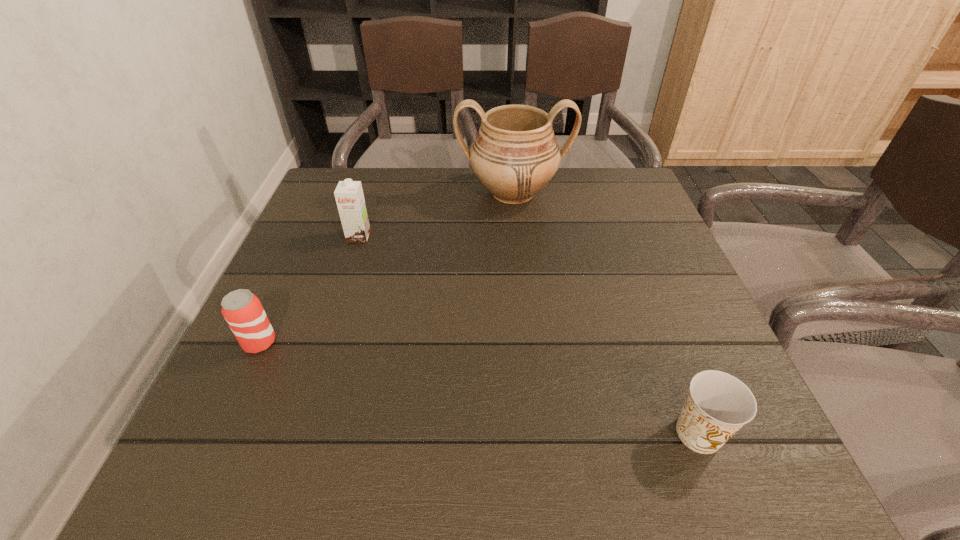
Where is `free space at the left edge of the desktop`? free space at the left edge of the desktop is located at coordinates (228, 382).

This screenshot has width=960, height=540. I want to click on vacant region at the right edge of the desktop, so click(x=611, y=278).

Find the location of a particular element. This screenshot has height=540, width=960. free space at the far left corner of the desktop is located at coordinates (339, 172).

Find the location of a particular element. free space at the far right corner is located at coordinates (588, 210).

Where is `vacant space that's between the beer can and the urn`? This screenshot has height=540, width=960. vacant space that's between the beer can and the urn is located at coordinates (386, 268).

The height and width of the screenshot is (540, 960). Find the location of `unoccupied position between the nearest object and the beer can`. unoccupied position between the nearest object and the beer can is located at coordinates (479, 388).

This screenshot has width=960, height=540. What are the coordinates of `vacant space that is in between the Dixie cup and the leftmost object` in the screenshot? It's located at (479, 388).

The image size is (960, 540). I want to click on free space that is in between the tallest object and the second farthest object, so click(x=436, y=215).

At what (x,y) coordinates should I click in order to perform the action: click on empty space between the farthest object and the beer can. Please return your answer as a coordinate pair (x, y). The width and height of the screenshot is (960, 540). Looking at the image, I should click on (386, 268).

Identify the location of free space between the second farthest object and the tallest object. (436, 215).